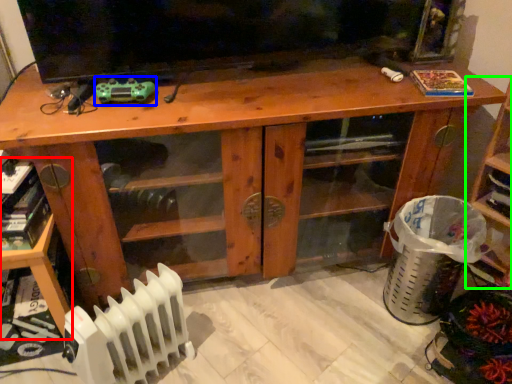
Question: Considering the real-world distances, which object is farthest from shelf (highlighted by a red box)? toy (highlighted by a blue box) or shelf (highlighted by a green box)?

Choices:
 (A) toy
 (B) shelf

Answer: (B)